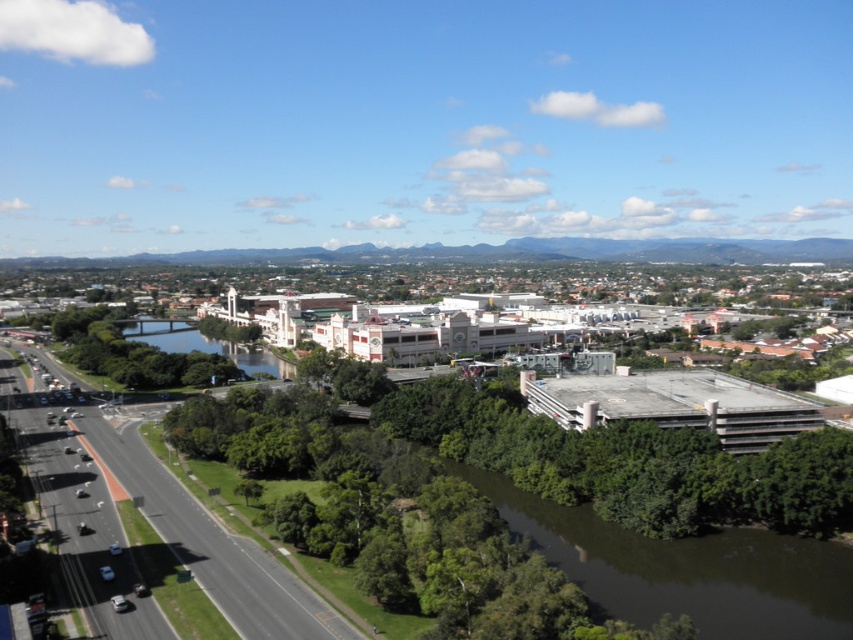
Who is more distant from viewer, (746,589) or (225,330)?

The point (225,330) is behind.

Is green murky water at lower center wider than green leafy tree at center?

Indeed, green murky water at lower center has a greater width compared to green leafy tree at center.

Identify the location of green murky water at lower center. This screenshot has width=853, height=640. (688, 570).

Is green reflective water at center below green leafy tree at center?

Correct, green reflective water at center is located below green leafy tree at center.

Who is more forward, [134,323] or [202,333]?

Positioned in front is point [202,333].

Locate an element on the screen. green reflective water at center is located at coordinates (207, 346).

Who is positioned more to the left, green murky water at lower center or green reflective water at center?

green reflective water at center

Does green murky water at lower center have a larger size compared to green reflective water at center?

Actually, green murky water at lower center might be smaller than green reflective water at center.

What do you see at coordinates (688, 570) in the screenshot? The height and width of the screenshot is (640, 853). I see `green murky water at lower center` at bounding box center [688, 570].

The width and height of the screenshot is (853, 640). I want to click on green murky water at lower center, so click(688, 570).